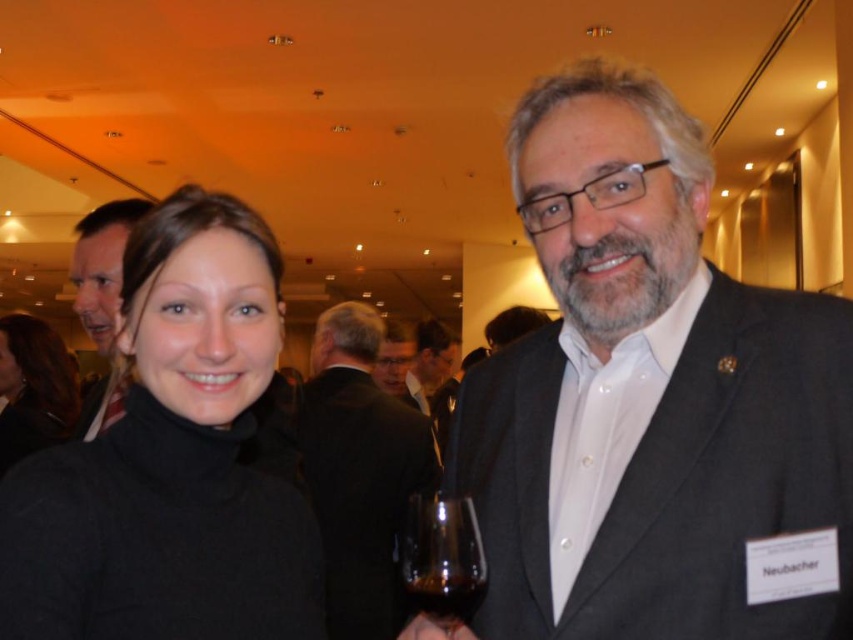
Question: Which is nearer to the matte black suit at left?

Choices:
 (A) black turtleneck sweater at center
 (B) matte black glasses at center
 (C) dark gray suit at center
 (D) black woolen sweater at left

Answer: (A)

Question: Is black suit at center closer to camera compared to dark glass wine at lower center?

Choices:
 (A) no
 (B) yes

Answer: (A)

Question: Estimate the real-world distances between objects in this image. Which object is farther from the dark gray suit at center?

Choices:
 (A) transparent glass at center
 (B) matte black suit at center
 (C) matte black glasses at center

Answer: (A)

Question: Does dark glass wine at lower center have a greater width compared to dark gray suit at center?

Choices:
 (A) yes
 (B) no

Answer: (B)

Question: Is black woolen sweater at left below dark gray suit at center?

Choices:
 (A) no
 (B) yes

Answer: (A)

Question: Which point appears closest to the camera in this image?

Choices:
 (A) (428, 513)
 (B) (68, 378)
 (C) (227, 406)

Answer: (A)